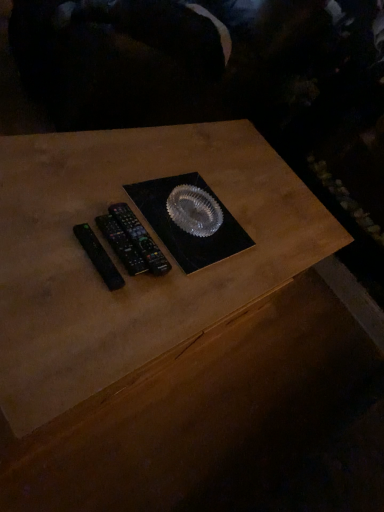
Identify the location of black plastic remote controls at center, which is the 1th control from back to front. The image size is (384, 512). (140, 239).

In terms of size, does black plastic remote controls at center, which is the 1th control from back to front, appear bigger or smaller than black plastic remote at left, placed as the third control when sorted from back to front?

black plastic remote controls at center, which is the 1th control from back to front, is bigger than black plastic remote at left, placed as the third control when sorted from back to front.

What's the angular difference between black plastic remote controls at center, which is the 1th control from back to front, and black plastic remote at left, placed as the third control when sorted from back to front,'s facing directions?

There is a 2.51-degree angle between the facing directions of black plastic remote controls at center, which is the 1th control from back to front, and black plastic remote at left, placed as the third control when sorted from back to front.

Is point (138, 252) more distant than point (107, 255)?

Yes.

Can you confirm if black plastic remote controls at center, acting as the 3th control starting from the front, is positioned to the right of black plastic remote at left, placed as the third control when sorted from back to front?

Result: Yes.

Is black plastic remote at left, the second control from the back, inside or outside of black plastic remote controls at center, which is the 1th control from back to front?

black plastic remote at left, the second control from the back, is spatially situated outside black plastic remote controls at center, which is the 1th control from back to front.

Identify the location of the 1st control positioned above the black plastic remote at left, the second control from the back (from a real-world perspective). Image resolution: width=384 pixels, height=512 pixels. (140, 239).

From the image's perspective, between black plastic remote at left, positioned as the second control in front-to-back order, and black plastic remote controls at center, acting as the 3th control starting from the front, who is located below?

black plastic remote at left, positioned as the second control in front-to-back order, is shown below in the image.

Is point (131, 253) closer to viewer compared to point (130, 223)?

That is True.

Is black plastic remote at left, positioned as the second control in front-to-back order, beside black plastic remote at left, the 1th control viewed from the front?

Indeed, black plastic remote at left, positioned as the second control in front-to-back order, and black plastic remote at left, the 1th control viewed from the front, are beside each other and touching.

Is black plastic remote at left, the second control from the back, completely or partially outside of black plastic remote at left, the 1th control viewed from the front?

Yes.

Can you confirm if black plastic remote at left, the second control from the back, is shorter than black plastic remote at left, the 1th control viewed from the front?

Incorrect, the height of black plastic remote at left, the second control from the back, does not fall short of that of black plastic remote at left, the 1th control viewed from the front.

Which object is thinner, black plastic remote at left, positioned as the second control in front-to-back order, or black plastic remote at left, the 1th control viewed from the front?

With smaller width is black plastic remote at left, the 1th control viewed from the front.

Between black plastic remote at left, placed as the third control when sorted from back to front, and black plastic remote controls at center, acting as the 3th control starting from the front, which one has less height?

Standing shorter between the two is black plastic remote at left, placed as the third control when sorted from back to front.

In terms of size, does black plastic remote at left, the 1th control viewed from the front, appear bigger or smaller than black plastic remote controls at center, acting as the 3th control starting from the front?

Clearly, black plastic remote at left, the 1th control viewed from the front, is smaller in size than black plastic remote controls at center, acting as the 3th control starting from the front.

You are a GUI agent. You are given a task and a screenshot of the screen. Output one action in this format:
    pyautogui.click(x=<x>, y=<y>)
    Task: Click on the control that is on the left side of black plastic remote at left, the second control from the back
    
    Given the screenshot: What is the action you would take?
    (98, 257)

Is black plastic remote at left, placed as the third control when sorted from back to front, in front of black plastic remote at left, positioned as the second control in front-to-back order?

Yes, it is.

Is black plastic remote at left, placed as the third control when sorted from back to front, taller than black plastic remote at left, positioned as the second control in front-to-back order?

No.

Which of these two, black plastic remote at left, the 1th control viewed from the front, or black plastic remote at left, the second control from the back, is wider?

black plastic remote at left, the second control from the back.

Is there a large distance between black plastic remote controls at center, acting as the 3th control starting from the front, and black plastic remote at left, the second control from the back?

Actually, black plastic remote controls at center, acting as the 3th control starting from the front, and black plastic remote at left, the second control from the back, are a little close together.

Would you say black plastic remote at left, positioned as the second control in front-to-back order, is part of black plastic remote controls at center, which is the 1th control from back to front,'s contents?

Definitely not — black plastic remote at left, positioned as the second control in front-to-back order, is not inside black plastic remote controls at center, which is the 1th control from back to front.

In the scene shown: Is black plastic remote controls at center, acting as the 3th control starting from the front, at the left side of black plastic remote at left, positioned as the second control in front-to-back order?

No, black plastic remote controls at center, acting as the 3th control starting from the front, is not to the left of black plastic remote at left, positioned as the second control in front-to-back order.

The width and height of the screenshot is (384, 512). I want to click on the 2nd control behind the black plastic remote at left, the 1th control viewed from the front, so click(x=140, y=239).

I want to click on the 1st control to the left when counting from the black plastic remote controls at center, acting as the 3th control starting from the front, so click(x=121, y=245).

Which object lies nearer to the anchor point black plastic remote at left, the second control from the back, black plastic remote at left, the 1th control viewed from the front, or black plastic remote controls at center, which is the 1th control from back to front?

black plastic remote controls at center, which is the 1th control from back to front, lies closer to black plastic remote at left, the second control from the back, than the other object.

Looking at this image, from the image, which object appears to be farther from black plastic remote controls at center, which is the 1th control from back to front, black plastic remote at left, positioned as the second control in front-to-back order, or black plastic remote at left, placed as the third control when sorted from back to front?

black plastic remote at left, placed as the third control when sorted from back to front, is positioned further to the anchor black plastic remote controls at center, which is the 1th control from back to front.

Which object lies further to the anchor point black plastic remote at left, the 1th control viewed from the front, black plastic remote controls at center, which is the 1th control from back to front, or black plastic remote at left, the second control from the back?

black plastic remote controls at center, which is the 1th control from back to front, is positioned further to the anchor black plastic remote at left, the 1th control viewed from the front.

Considering their positions, is black plastic remote at left, the second control from the back, positioned further to black plastic remote at left, placed as the third control when sorted from back to front, than black plastic remote controls at center, acting as the 3th control starting from the front?

The object further to black plastic remote at left, placed as the third control when sorted from back to front, is black plastic remote controls at center, acting as the 3th control starting from the front.

Considering their positions, is black plastic remote at left, placed as the third control when sorted from back to front, positioned further to black plastic remote controls at center, acting as the 3th control starting from the front, than black plastic remote at left, the second control from the back?

black plastic remote at left, placed as the third control when sorted from back to front, is further to black plastic remote controls at center, acting as the 3th control starting from the front.

When comparing their distances from black plastic remote at left, the second control from the back, does black plastic remote controls at center, acting as the 3th control starting from the front, or black plastic remote at left, the 1th control viewed from the front, seem further?

Based on the image, black plastic remote at left, the 1th control viewed from the front, appears to be further to black plastic remote at left, the second control from the back.

At what (x,y) coordinates should I click in order to perform the action: click on control located between black plastic remote at left, placed as the third control when sorted from back to front, and black plastic remote controls at center, acting as the 3th control starting from the front, in the depth direction. Please return your answer as a coordinate pair (x, y). This screenshot has height=512, width=384. Looking at the image, I should click on (121, 245).